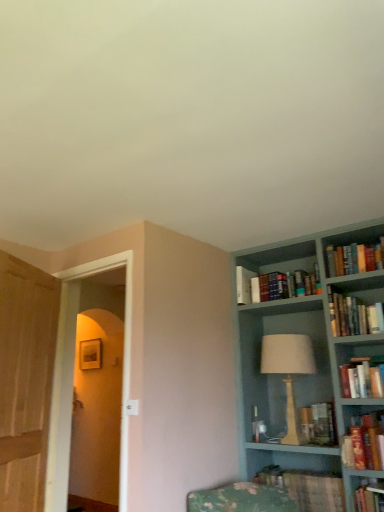
Where is `hardcover book at right, which is counted as the 5th book, starting from the top`? hardcover book at right, which is counted as the 5th book, starting from the top is located at coordinates (364, 442).

This screenshot has width=384, height=512. What do you see at coordinates (25, 380) in the screenshot?
I see `wooden door at left, the first glass door when ordered from left to right` at bounding box center [25, 380].

Image resolution: width=384 pixels, height=512 pixels. Find the location of `hardcover book at right, acting as the second book starting from the bottom`. hardcover book at right, acting as the second book starting from the bottom is located at coordinates (364, 442).

Which of these two, teal painted wood bookcase at right or hardcover books at upper right, which is the first book from top to bottom, is thinner?

Thinner between the two is hardcover books at upper right, which is the first book from top to bottom.

Consider the image. Who is shorter, teal painted wood bookcase at right or hardcover books at upper right, which is the first book from top to bottom?

Standing shorter between the two is hardcover books at upper right, which is the first book from top to bottom.

Could you tell me if teal painted wood bookcase at right is facing hardcover books at upper right, positioned as the 6th book in bottom-to-top order?

Yes, teal painted wood bookcase at right is aimed at hardcover books at upper right, positioned as the 6th book in bottom-to-top order.

Which of these two, wooden door at left, positioned as the 2th glass door in right-to-left order, or teal painted wood bookcase at right, is bigger?

teal painted wood bookcase at right is bigger.

Between wooden door at left, the first glass door when ordered from left to right, and teal painted wood bookcase at right, which one has less height?

With less height is wooden door at left, the first glass door when ordered from left to right.

Is wooden door at left, positioned as the 2th glass door in right-to-left order, far away from teal painted wood bookcase at right?

That's right, there is a large distance between wooden door at left, positioned as the 2th glass door in right-to-left order, and teal painted wood bookcase at right.

Does wooden door at left, positioned as the 2th glass door in right-to-left order, lie in front of teal painted wood bookcase at right?

Yes, the depth of wooden door at left, positioned as the 2th glass door in right-to-left order, is less than that of teal painted wood bookcase at right.

Considering their positions, is hardcover books at upper right, which is the first book from top to bottom, located in front of or behind hardcover books at upper right, positioned as the fourth book in bottom-to-top order?

Visually, hardcover books at upper right, which is the first book from top to bottom, is located behind hardcover books at upper right, positioned as the fourth book in bottom-to-top order.

From a real-world perspective, starting from the hardcover books at upper right, positioned as the 3th book in top-to-bottom order, which book is the 2nd one vertically above it? Please provide its 2D coordinates.

[(354, 258)]

Which is more to the left, hardcover books at upper right, positioned as the 6th book in bottom-to-top order, or hardcover books at upper right, positioned as the fourth book in bottom-to-top order?

Positioned to the left is hardcover books at upper right, positioned as the fourth book in bottom-to-top order.

Does hardcover books at upper right, positioned as the 6th book in bottom-to-top order, turn towards hardcover books at upper right, positioned as the 3th book in top-to-bottom order?

No, hardcover books at upper right, positioned as the 6th book in bottom-to-top order, is not turned towards hardcover books at upper right, positioned as the 3th book in top-to-bottom order.

Is hardcover books at upper right, positioned as the 3th book in top-to-bottom order, next to hardcover book at right, acting as the second book starting from the bottom?

No, hardcover books at upper right, positioned as the 3th book in top-to-bottom order, is not beside hardcover book at right, acting as the second book starting from the bottom.

Can you confirm if hardcover books at upper right, positioned as the 3th book in top-to-bottom order, is bigger than hardcover book at right, acting as the second book starting from the bottom?

Yes, hardcover books at upper right, positioned as the 3th book in top-to-bottom order, is bigger than hardcover book at right, acting as the second book starting from the bottom.

Which object is positioned more to the left, hardcover books at upper right, positioned as the 3th book in top-to-bottom order, or hardcover book at right, which is counted as the 5th book, starting from the top?

From the viewer's perspective, hardcover book at right, which is counted as the 5th book, starting from the top, appears more on the left side.

Is hardcover books at right, acting as the fourth book starting from the top, taller or shorter than wooden table lamp at center-right?

hardcover books at right, acting as the fourth book starting from the top, is shorter than wooden table lamp at center-right.

Between hardcover books at right, acting as the fourth book starting from the top, and wooden table lamp at center-right, which one appears on the right side from the viewer's perspective?

Positioned to the right is hardcover books at right, acting as the fourth book starting from the top.

Is there a large distance between hardcover books at right, acting as the fourth book starting from the top, and wooden table lamp at center-right?

They are positioned close to each other.

From the image's perspective, is hardcover books at right, acting as the fourth book starting from the top, over wooden table lamp at center-right?

Indeed, from the image's perspective, hardcover books at right, acting as the fourth book starting from the top, is shown above wooden table lamp at center-right.

Which object is further away from the camera, white matte paperback book at upper right or wooden door at left, positioned as the 2th glass door in right-to-left order?

Positioned behind is white matte paperback book at upper right.

Is point (243, 294) farther from camera compared to point (25, 462)?

Yes, it is behind point (25, 462).

Is white matte paperback book at upper right directly adjacent to wooden door at left, the first glass door when ordered from left to right?

No, white matte paperback book at upper right is not touching wooden door at left, the first glass door when ordered from left to right.

Is hardcover books at upper right, positioned as the 3th book in top-to-bottom order, next to wooden table lamp at center-right?

No, hardcover books at upper right, positioned as the 3th book in top-to-bottom order, is not making contact with wooden table lamp at center-right.

Can you confirm if hardcover books at upper right, positioned as the fourth book in bottom-to-top order, is wider than wooden table lamp at center-right?

Indeed, hardcover books at upper right, positioned as the fourth book in bottom-to-top order, has a greater width compared to wooden table lamp at center-right.

Is hardcover books at upper right, positioned as the fourth book in bottom-to-top order, closer to the viewer compared to wooden table lamp at center-right?

Yes, hardcover books at upper right, positioned as the fourth book in bottom-to-top order, is in front of wooden table lamp at center-right.

Identify the location of bookcase below the hardcover books at upper right, positioned as the 6th book in bottom-to-top order (from a real-world perspective). (313, 350).

Where is `glass door located above the teal painted wood bookcase at right (from the image's perspective)`? The image size is (384, 512). glass door located above the teal painted wood bookcase at right (from the image's perspective) is located at coordinates (25, 380).

From the image, which object appears to be nearer to hardcover books at upper right, positioned as the fourth book in bottom-to-top order, teal painted wood bookcase at right or transparent glass door at left, the 1th glass door positioned from the right?

teal painted wood bookcase at right.

Based on their spatial positions, is transparent glass door at left, the 1th glass door positioned from the right, or hardcover books at upper right, which appears as the fifth book when ordered from the bottom, further from hardcover books at upper right, positioned as the 6th book in bottom-to-top order?

transparent glass door at left, the 1th glass door positioned from the right.

From the picture: Based on their spatial positions, is hardcover books at right, acting as the third book starting from the bottom, or hardcover books at upper right, which appears as the fifth book when ordered from the bottom, closer to transparent glass door at left, the 1th glass door positioned from the right?

The object closer to transparent glass door at left, the 1th glass door positioned from the right, is hardcover books at upper right, which appears as the fifth book when ordered from the bottom.

Based on their spatial positions, is hardcover books at upper right, positioned as the fourth book in bottom-to-top order, or hardcover books at upper right, which appears as the fifth book when ordered from the bottom, further from hardcover books at upper right, positioned as the 6th book in bottom-to-top order?

hardcover books at upper right, which appears as the fifth book when ordered from the bottom.

When comparing their distances from white matte paperback book at upper right, does hardcover book at right, which is counted as the 5th book, starting from the top, or hardcover book at lower right, acting as the first book starting from the bottom, seem further?

hardcover book at lower right, acting as the first book starting from the bottom, is further to white matte paperback book at upper right.

From the image, which object appears to be farther from hardcover books at upper right, which is the second book from top to bottom, hardcover books at right, acting as the third book starting from the bottom, or teal painted wood bookcase at right?

hardcover books at right, acting as the third book starting from the bottom, is positioned further to the anchor hardcover books at upper right, which is the second book from top to bottom.

Considering their positions, is hardcover books at upper right, positioned as the 6th book in bottom-to-top order, positioned closer to hardcover book at lower right, acting as the first book starting from the bottom, than white matte paperback book at upper right?

The object closer to hardcover book at lower right, acting as the first book starting from the bottom, is white matte paperback book at upper right.

From the image, which object appears to be farther from hardcover books at upper right, positioned as the fourth book in bottom-to-top order, hardcover book at lower right, which is counted as the sixth book, starting from the top, or hardcover book at right, acting as the second book starting from the bottom?

hardcover book at lower right, which is counted as the sixth book, starting from the top, is positioned further to the anchor hardcover books at upper right, positioned as the fourth book in bottom-to-top order.

Where is `paperback book between transparent glass door at left, which appears as the 2th glass door when viewed from the left, and hardcover book at right, which is counted as the 5th book, starting from the top, in the horizontal direction`? paperback book between transparent glass door at left, which appears as the 2th glass door when viewed from the left, and hardcover book at right, which is counted as the 5th book, starting from the top, in the horizontal direction is located at coordinates (243, 285).

Identify the location of table lamp situated between wooden door at left, the first glass door when ordered from left to right, and teal painted wood bookcase at right from left to right. This screenshot has width=384, height=512. (288, 372).

Locate an element on the screen. table lamp situated between wooden door at left, the first glass door when ordered from left to right, and hardcover books at upper right, positioned as the 6th book in bottom-to-top order, from left to right is located at coordinates (288, 372).

Image resolution: width=384 pixels, height=512 pixels. I want to click on bookcase between hardcover books at upper right, positioned as the fourth book in bottom-to-top order, and hardcover book at right, acting as the second book starting from the bottom, in the vertical direction, so click(313, 350).